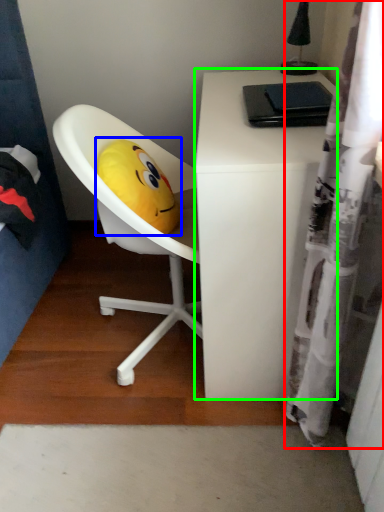
Question: Which object is positioned closest to shower curtain (highlighted by a red box)? Select from toy (highlighted by a blue box) and desk (highlighted by a green box).

Choices:
 (A) toy
 (B) desk

Answer: (B)